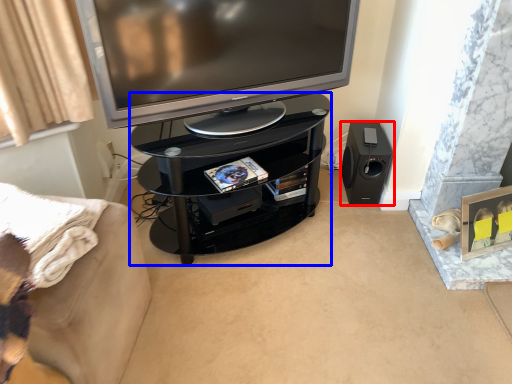
Question: Among these objects, which one is farthest to the camera, loudspeaker (highlighted by a red box) or tv cabinet (highlighted by a blue box)?

Choices:
 (A) loudspeaker
 (B) tv cabinet

Answer: (A)